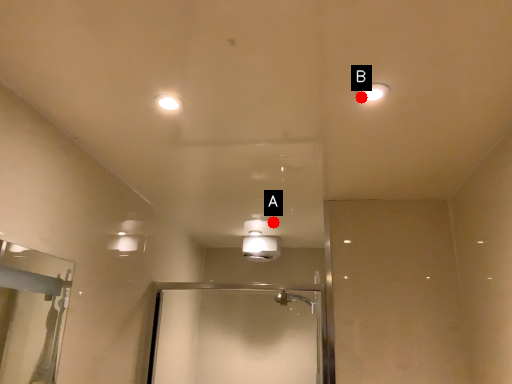
Question: Two points are circled on the image, labeled by A and B beside each circle. Which point is further to the camera?

Choices:
 (A) A is further
 (B) B is further

Answer: (A)